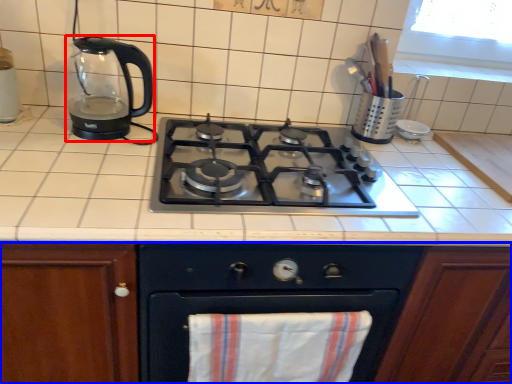
Question: Which of the following is the farthest to the observer, kitchen appliance (highlighted by a red box) or cabinetry (highlighted by a blue box)?

Choices:
 (A) kitchen appliance
 (B) cabinetry

Answer: (A)